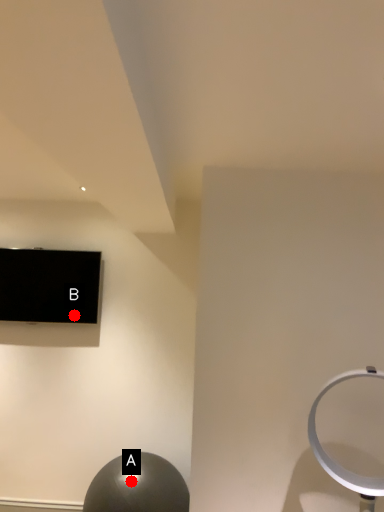
Question: Two points are circled on the image, labeled by A and B beside each circle. Which point is closer to the camera?

Choices:
 (A) A is closer
 (B) B is closer

Answer: (A)